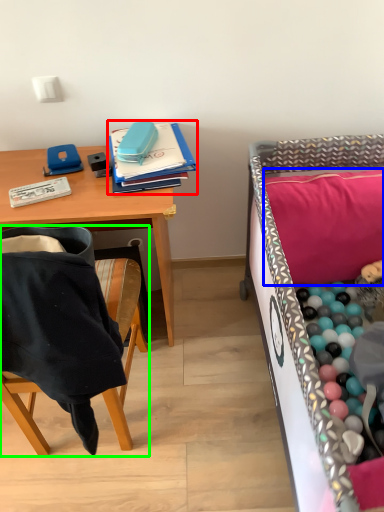
Question: Estimate the real-world distances between objects in this image. Which object is farther from notebook (highlighted by a red box), pillow (highlighted by a blue box) or chair (highlighted by a green box)?

Choices:
 (A) pillow
 (B) chair

Answer: (A)